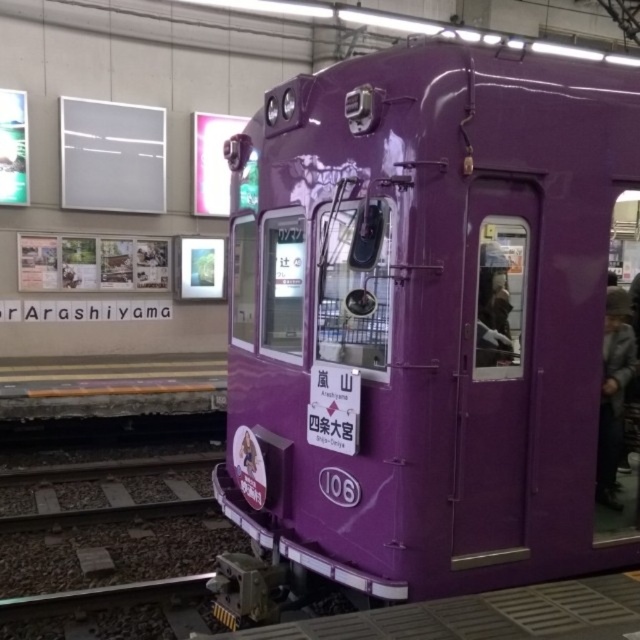
You are standing on the platform looking at the train car. There are two points marked on the train car. The first point is at coordinate point (474,330) and the second is at point (611,324). Which point appears closer to you?

The point at coordinate point (474,330) is closer to the camera than point (611,324), so the first point appears closer to you.